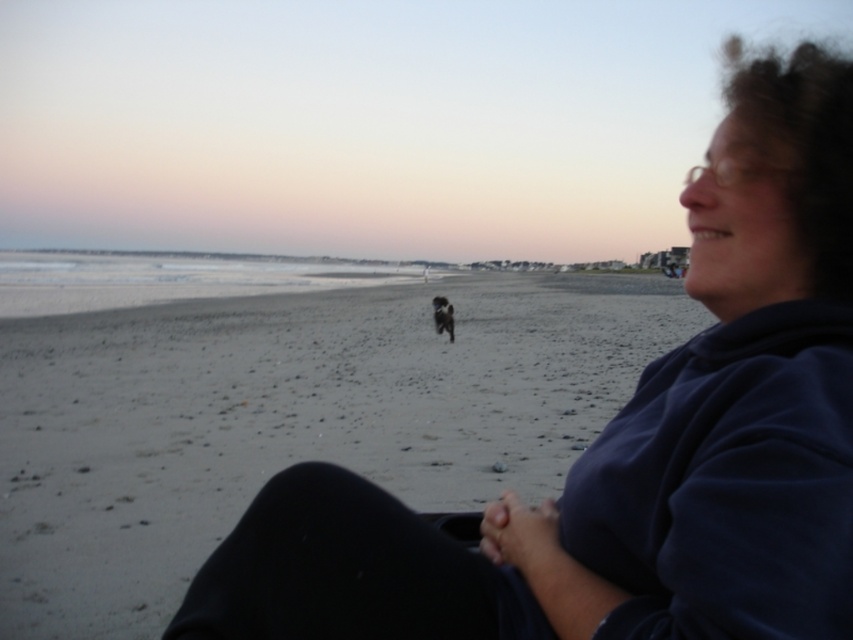
You are standing on the beach and see the gray sand at center and the black fur dog at center. Which object is closer to you?

The gray sand at center is closer to you because it is in front of the black fur dog at center.

You are planning to build a sandcastle on the beach. Given the gray sand at center and the black fur dog at center, which material would be more suitable for building the sandcastle?

The gray sand at center is larger in size than the black fur dog at center, so the gray sand at center would be more suitable for building a sandcastle since larger grains provide better structure.

You are a photographer standing at the edge of the beach. You want to take a photo of the black fur dog at center and the gray sand at center. Which object will appear larger in the photo?

The gray sand at center will appear larger in the photo because it is much taller than the black fur dog at center.